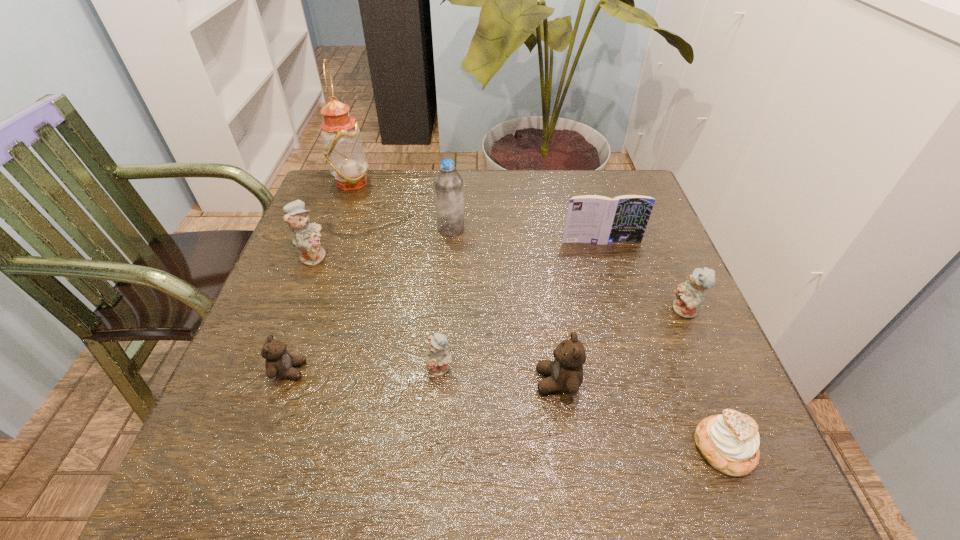
Identify the location of object at the near edge. point(730,442).

Where is `oil lamp at the left edge`? The width and height of the screenshot is (960, 540). oil lamp at the left edge is located at coordinates (343, 148).

At what (x,y) coordinates should I click in order to perform the action: click on book located at the right edge. Please return your answer as a coordinate pair (x, y). The height and width of the screenshot is (540, 960). Looking at the image, I should click on (595, 219).

The width and height of the screenshot is (960, 540). I want to click on teddy bear present at the right edge, so click(689, 295).

Where is `pastry located at the right edge`? pastry located at the right edge is located at coordinates (730, 442).

Where is `object at the far left corner`? Image resolution: width=960 pixels, height=540 pixels. object at the far left corner is located at coordinates (343, 148).

Locate an element on the screen. object that is positioned at the near right corner is located at coordinates (730, 442).

This screenshot has width=960, height=540. What are the coordinates of `free space at the far edge of the desktop` in the screenshot? It's located at (468, 190).

The height and width of the screenshot is (540, 960). In the image, there is a desktop. What are the coordinates of `vacant area at the near edge` in the screenshot? It's located at (533, 487).

This screenshot has width=960, height=540. I want to click on vacant point at the left edge, so coord(329,263).